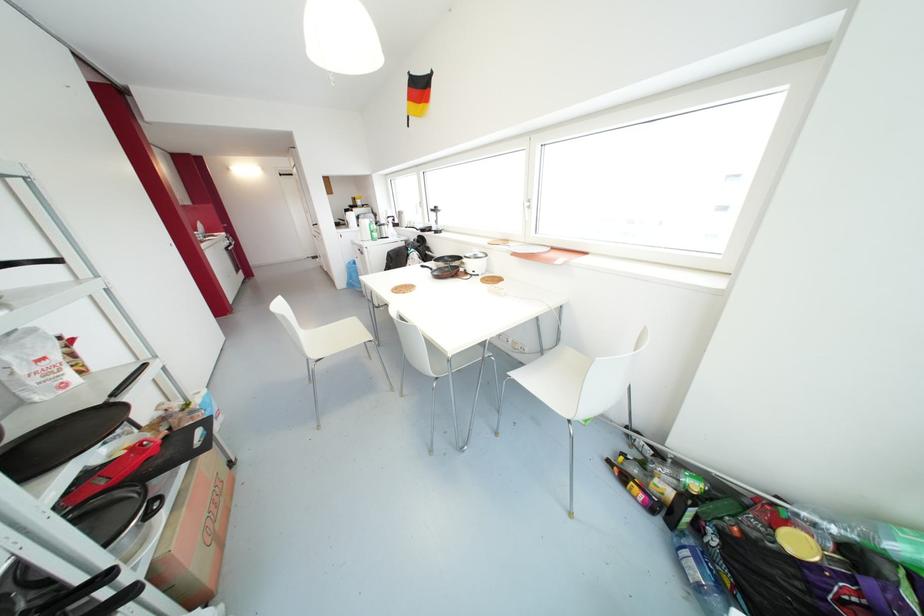
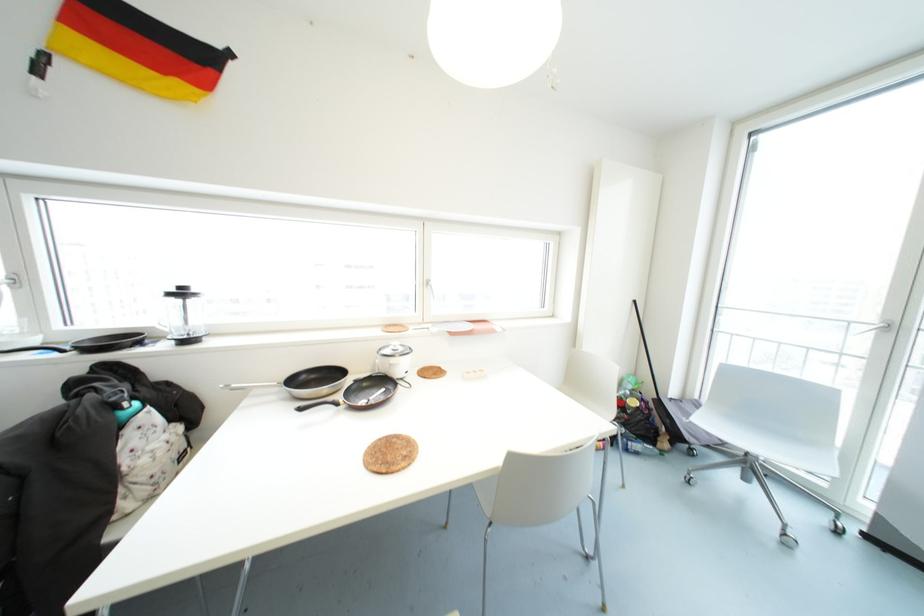
Find the pixel in the second image that matches point 421,265 in the first image.

(300, 408)